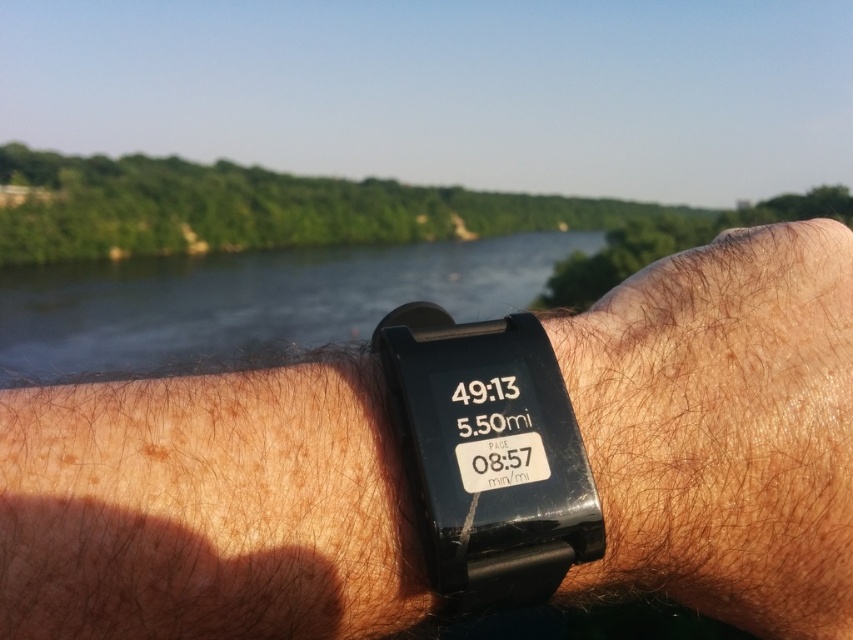
Question: Does black matte watch at center have a lesser width compared to brown hairy skin at center?

Choices:
 (A) yes
 (B) no

Answer: (B)

Question: Which object appears closest to the camera in this image?

Choices:
 (A) brown hairy skin at center
 (B) black matte watch at center
 (C) black plastic watch at center

Answer: (B)

Question: Considering the relative positions of brown hairy skin at center and black plastic watch at center in the image provided, where is brown hairy skin at center located with respect to black plastic watch at center?

Choices:
 (A) right
 (B) left

Answer: (A)

Question: Is black matte watch at center above dark blue water at center?

Choices:
 (A) yes
 (B) no

Answer: (B)

Question: Which object is the closest to the black matte watch at center?

Choices:
 (A) brown hairy skin at center
 (B) dark blue water at center

Answer: (A)

Question: Which object is positioned farthest from the dark blue water at center?

Choices:
 (A) black plastic watch at center
 (B) black matte watch at center

Answer: (A)